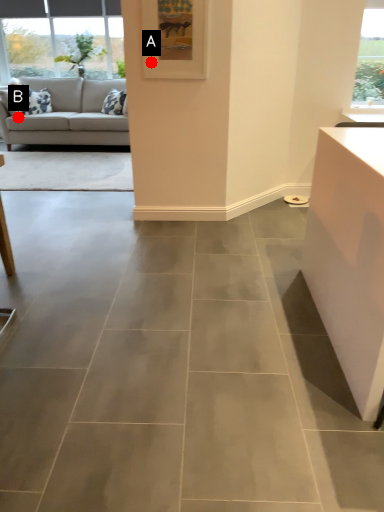
Question: Two points are circled on the image, labeled by A and B beside each circle. Which point is closer to the camera taking this photo?

Choices:
 (A) A is closer
 (B) B is closer

Answer: (A)